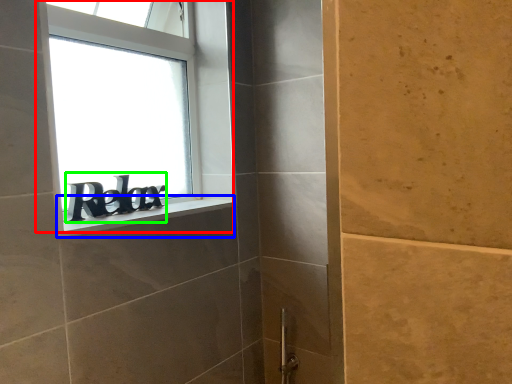
Question: Which object is the farthest from window (highlighted by a red box)? Choose among these: window sill (highlighted by a blue box) or writing (highlighted by a green box).

Choices:
 (A) window sill
 (B) writing

Answer: (A)